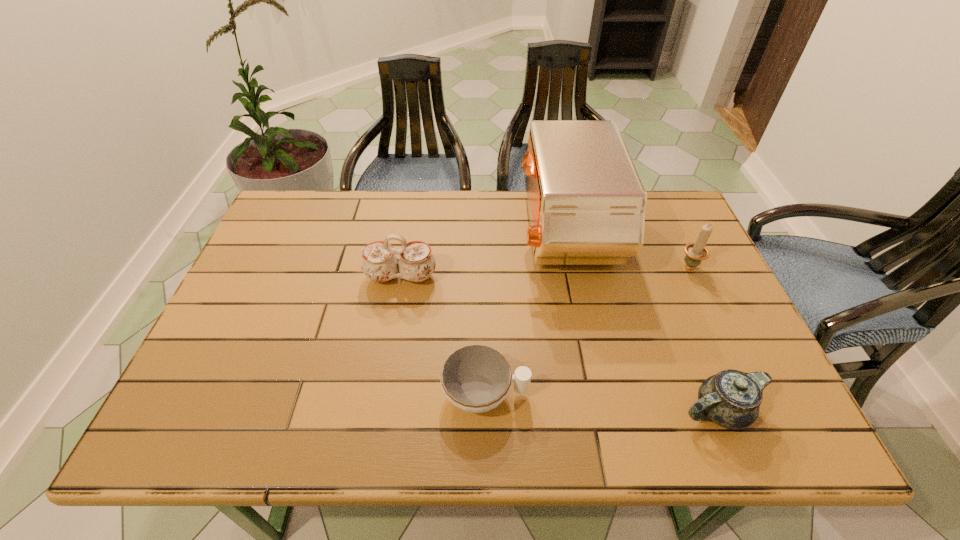
Select which chinaware is the second closest to the shortest object. Please provide its 2D coordinates. Your answer should be formatted as a tuple, i.e. [(x, y)], where the tuple contains the x and y coordinates of a point satisfying the conditions above.

[(731, 399)]

Locate an element on the screen. This screenshot has height=540, width=960. free point that satisfies the following two spatial constraints: 1. on the door side of the tallest object; 2. on the handle side of the candle_holder is located at coordinates (571, 265).

I want to click on free space in the image that satisfies the following two spatial constraints: 1. on the handle side of the candle_holder; 2. on the door side of the tallest object, so click(x=674, y=234).